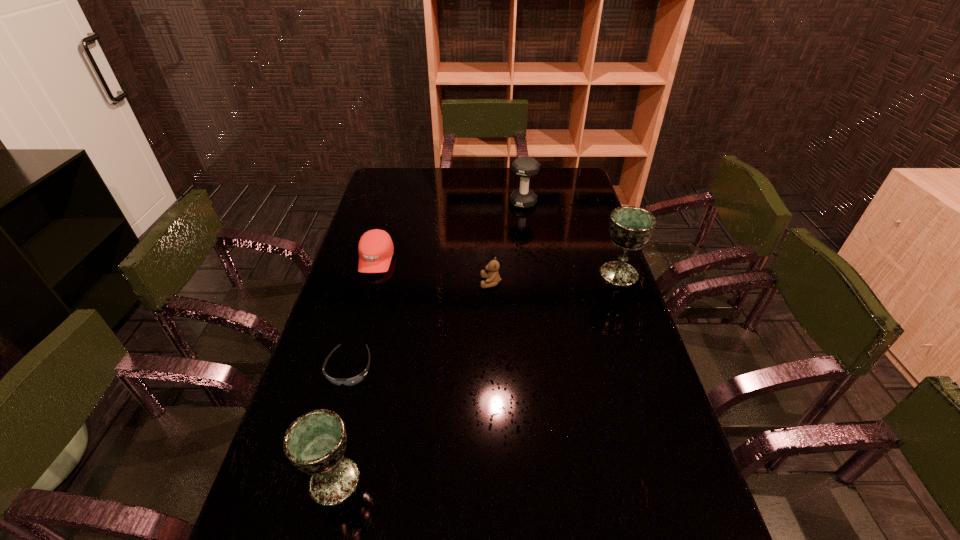
Find the location of a particular element. cap that is at the left edge is located at coordinates (375, 247).

This screenshot has height=540, width=960. Find the location of `sunglasses present at the left edge`. sunglasses present at the left edge is located at coordinates click(x=355, y=380).

This screenshot has width=960, height=540. I want to click on object that is at the right edge, so pyautogui.click(x=630, y=227).

I want to click on object that is at the near left corner, so click(x=315, y=443).

Find the location of a particular element. Image resolution: width=960 pixels, height=540 pixels. vacant space at the far edge is located at coordinates 442,167.

The image size is (960, 540). I want to click on vacant space at the left edge of the desktop, so click(383, 212).

Locate an element on the screen. vacant space at the right edge of the desktop is located at coordinates (610, 327).

The width and height of the screenshot is (960, 540). I want to click on vacant space at the far left corner of the desktop, so click(x=413, y=181).

In the image, there is a desktop. In order to click on vacant space at the far right corner in this screenshot , I will do (579, 184).

The image size is (960, 540). I want to click on vacant area that lies between the dumbbell and the teddy bear, so click(x=507, y=243).